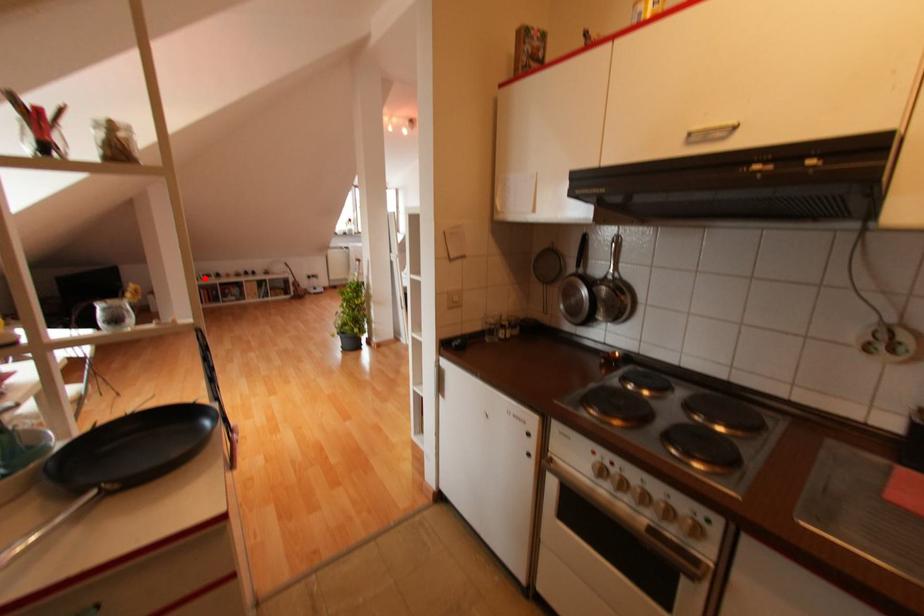
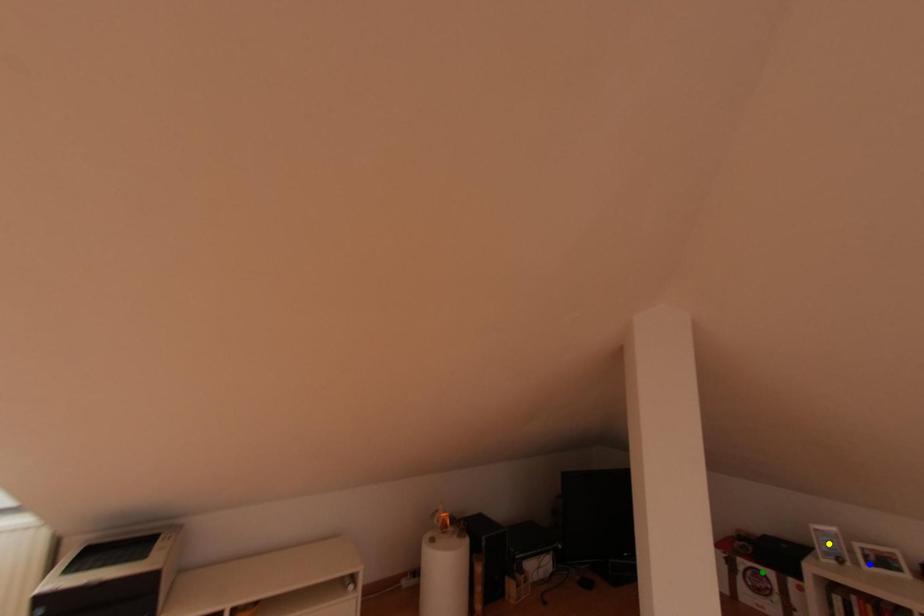
Question: I am providing you with two images of the same scene from different viewpoints. A red point is marked on the first image. You are given multiple points on the second image. Which point in image 2 represents the same 3d spot as the red point in image 1?

Choices:
 (A) blue point
 (B) yellow point
 (C) green point

Answer: (A)